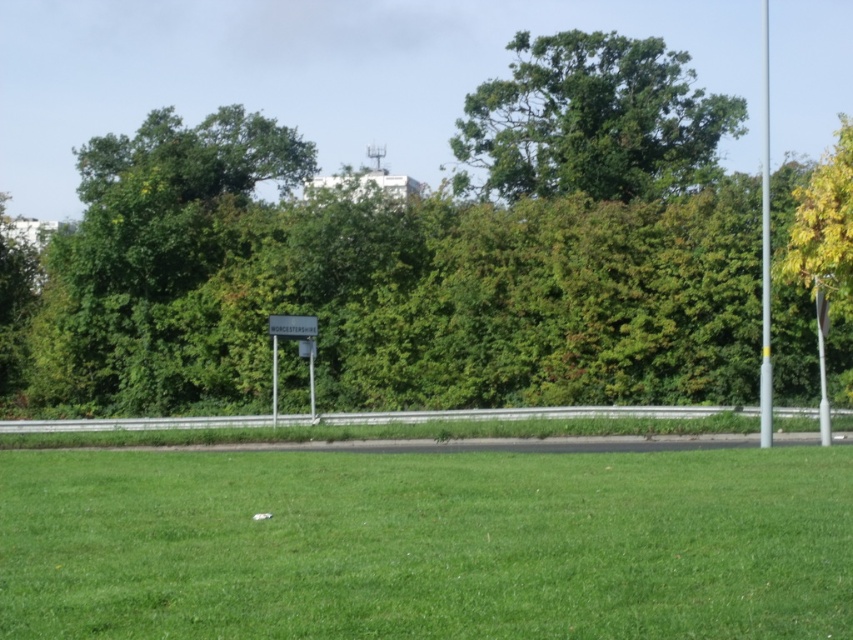
Does point (637, 172) come closer to viewer compared to point (85, 493)?

No.

Between green leafy tree at center and green grass at center, which one is positioned lower?

Positioned lower is green grass at center.

Does point (579, 84) come behind point (647, 596)?

Yes, point (579, 84) is farther from viewer.

Locate an element on the screen. This screenshot has height=640, width=853. green leafy tree at center is located at coordinates (410, 257).

Between green grass at center and white plastic sign at center, which one is positioned higher?

white plastic sign at center is above.

Who is more distant from viewer, (x=601, y=499) or (x=271, y=333)?

Point (x=271, y=333)

What do you see at coordinates (426, 545) in the screenshot? I see `green grass at center` at bounding box center [426, 545].

The height and width of the screenshot is (640, 853). I want to click on green grass at center, so click(426, 545).

From the picture: Does silver metallic pole at right appear on the left side of white plastic sign at center?

Incorrect, silver metallic pole at right is not on the left side of white plastic sign at center.

Which of these two, silver metallic pole at right or white plastic sign at center, stands shorter?

With less height is white plastic sign at center.

In order to click on silver metallic pole at right in this screenshot , I will do `click(764, 256)`.

In order to click on silver metallic pole at right in this screenshot , I will do `click(764, 256)`.